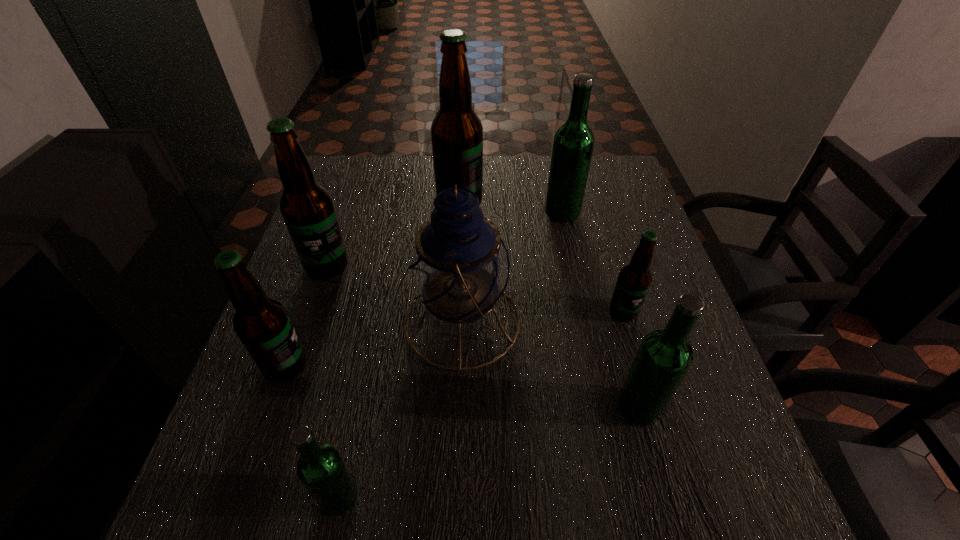
Identify the location of vacant space located on the label of the second nearest brown beer bottle. (662, 445).

You are a GUI agent. You are given a task and a screenshot of the screen. Output one action in this format:
    pyautogui.click(x=<x>, y=<y>)
    Task: Click on the free space located 0.210m on the right of the nearest object
    
    Given the screenshot: What is the action you would take?
    pyautogui.click(x=488, y=497)

You are a GUI agent. You are given a task and a screenshot of the screen. Output one action in this format:
    pyautogui.click(x=<x>, y=<y>)
    Task: Click on the object that is at the far edge
    This screenshot has width=960, height=540.
    Given the screenshot: What is the action you would take?
    pyautogui.click(x=456, y=132)

Where is `object that is positioned at the near edge`? The height and width of the screenshot is (540, 960). object that is positioned at the near edge is located at coordinates click(x=321, y=469).

The image size is (960, 540). In the image, there is a desktop. What are the coordinates of `free region at the far edge` in the screenshot? It's located at (417, 200).

Where is `free space at the near edge of the desktop`? The width and height of the screenshot is (960, 540). free space at the near edge of the desktop is located at coordinates (463, 528).

Find the location of a particular element. free space at the left edge is located at coordinates (305, 407).

Where is `vacant space at the right edge of the desktop`? This screenshot has width=960, height=540. vacant space at the right edge of the desktop is located at coordinates (660, 255).

Locate an element on the screen. free space at the far left corner is located at coordinates (372, 168).

Locate an element on the screen. This screenshot has height=540, width=960. vacant space that's between the second nearest object and the second nearest brown beer bottle is located at coordinates (631, 359).